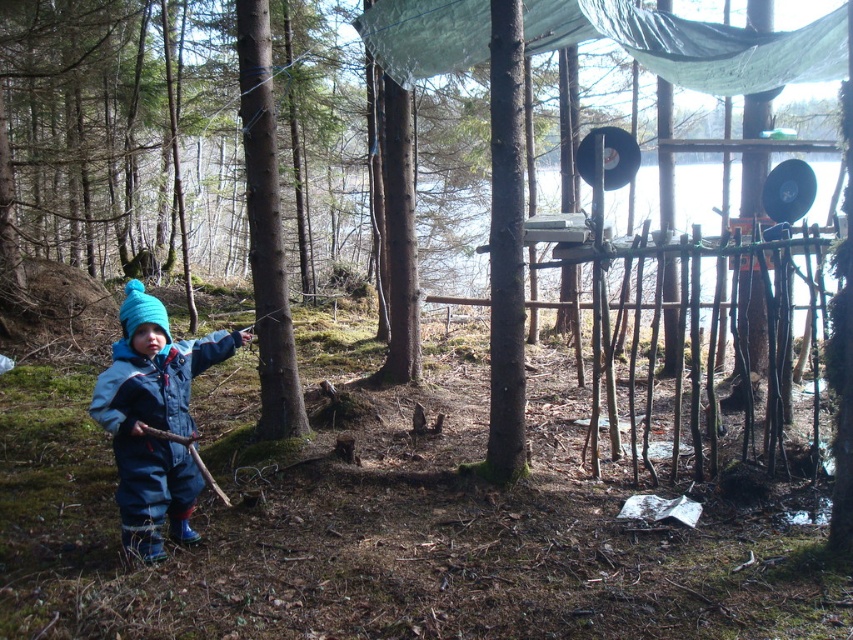
Question: Which point is closer to the camera?

Choices:
 (A) (141, 464)
 (B) (274, 179)
 (C) (589, 13)

Answer: (A)

Question: Which of the following is the farthest from the observer?

Choices:
 (A) brown rough bark tree at center
 (B) blue fleece jumpsuit at lower left
 (C) transparent tarpaulin at upper center

Answer: (C)

Question: In this image, where is transparent tarpaulin at upper center located relative to blue fleece jumpsuit at lower left?

Choices:
 (A) right
 (B) left

Answer: (A)

Question: Estimate the real-world distances between objects in this image. Which object is closer to the brown rough bark tree at center?

Choices:
 (A) blue fleece jumpsuit at lower left
 (B) transparent tarpaulin at upper center

Answer: (A)

Question: From the image, what is the correct spatial relationship of transparent tarpaulin at upper center in relation to brown rough bark tree at center?

Choices:
 (A) above
 (B) below

Answer: (A)

Question: In this image, where is transparent tarpaulin at upper center located relative to blue fleece jumpsuit at lower left?

Choices:
 (A) above
 (B) below

Answer: (A)